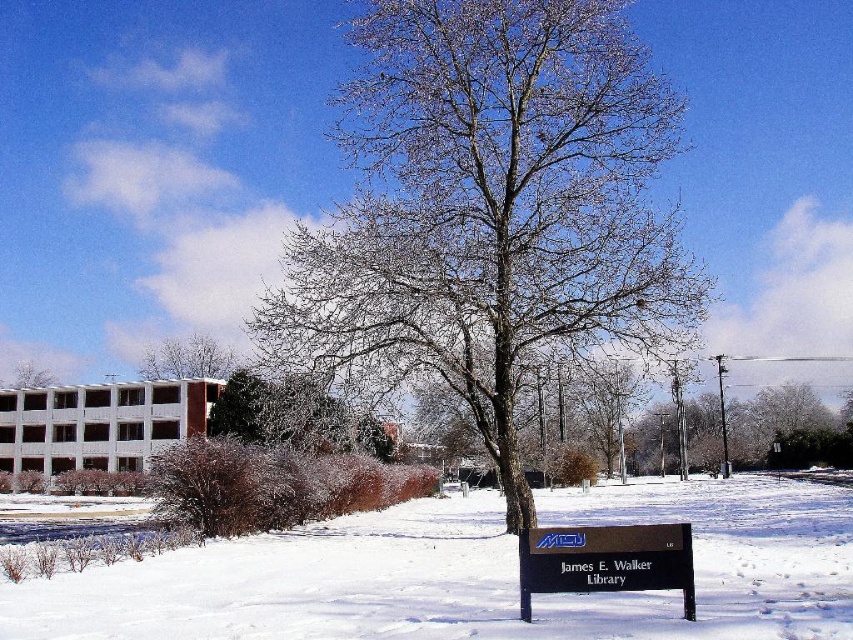
Question: Is snow-covered tree at center thinner than black plastic sign at lower center?

Choices:
 (A) yes
 (B) no

Answer: (B)

Question: Which point is closer to the camera?

Choices:
 (A) bare branches at center
 (B) black plastic sign at lower center

Answer: (B)

Question: Which point is closer to the camera?

Choices:
 (A) bare branches at upper center
 (B) snow-covered tree at center

Answer: (B)

Question: Observing the image, what is the correct spatial positioning of snow-covered tree at center in reference to bare branches at center?

Choices:
 (A) below
 (B) above

Answer: (B)

Question: Which object is farther from the camera taking this photo?

Choices:
 (A) black plastic sign at lower center
 (B) bare branches at center
 (C) snow-covered tree at center
 (D) bare branches at upper center

Answer: (B)

Question: Is white fluffy snow at lower center bigger than bare branches at upper center?

Choices:
 (A) no
 (B) yes

Answer: (B)